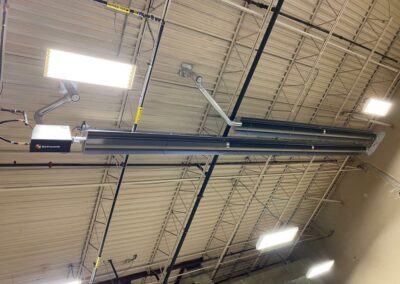
What are the coordinates of `black wiring connecting to box` in the screenshot? It's located at (15, 120), (14, 110).